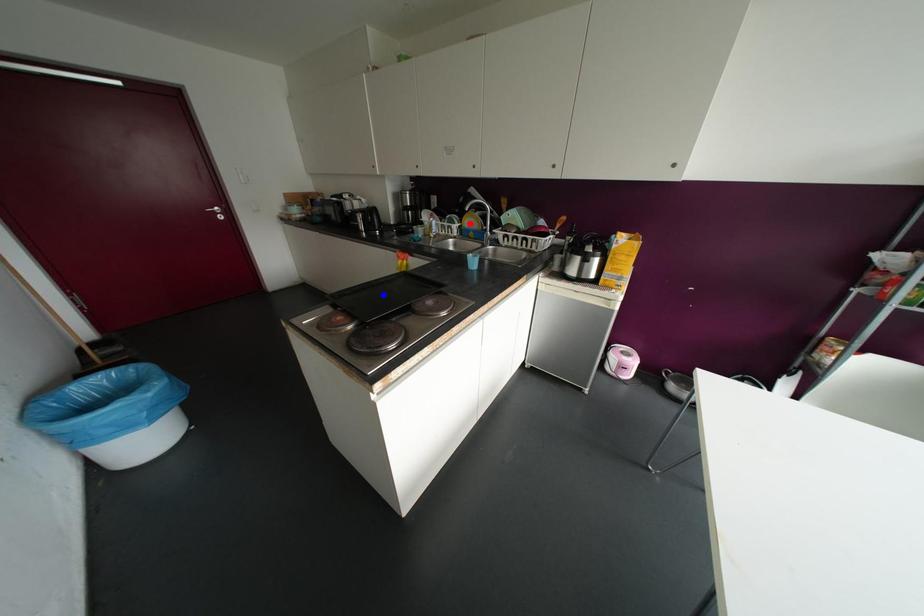
Question: In the image, two points are highlighted. Which point is nearer to the camera? Reply with the corresponding letter.

Choices:
 (A) blue point
 (B) red point

Answer: (A)